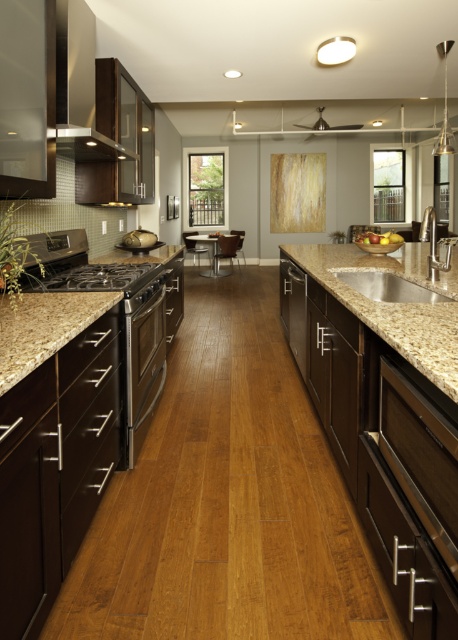
You are a kitchen designer planning to install a new backsplash behind the stainless steel oven at left and the granite sink at center. Since the oven is under the sink, where should the backsplash be placed to cover both appliances?

The backsplash should be placed behind both the stainless steel oven at left and the granite sink at center, as the oven is positioned under the sink, ensuring full coverage of both appliances.